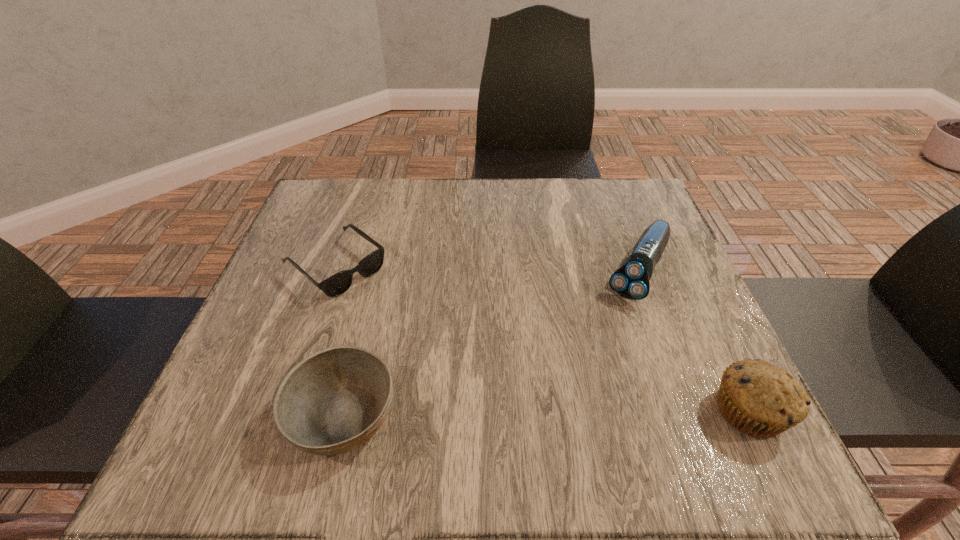
The width and height of the screenshot is (960, 540). In order to click on free location located 0.160m on the head of the electric shaver in this screenshot , I will do pos(597,357).

You are a GUI agent. You are given a task and a screenshot of the screen. Output one action in this format:
    pyautogui.click(x=<x>, y=<y>)
    Task: Click on the free space located on the head of the electric shaver
    
    Given the screenshot: What is the action you would take?
    pyautogui.click(x=589, y=373)

I want to click on bowl that is at the near edge, so click(x=333, y=401).

Where is `muffin at the near edge`? muffin at the near edge is located at coordinates (762, 400).

Locate an element on the screen. bowl at the left edge is located at coordinates (333, 401).

Identify the location of sunglasses at the left edge. Image resolution: width=960 pixels, height=540 pixels. (337, 284).

Where is `muffin that is at the right edge`? muffin that is at the right edge is located at coordinates (762, 400).

The height and width of the screenshot is (540, 960). Identify the location of electric shaver positioned at the right edge. (631, 281).

Where is `object that is positioned at the near left corner`? The width and height of the screenshot is (960, 540). object that is positioned at the near left corner is located at coordinates (333, 401).

Where is `object that is at the near right corner`? The image size is (960, 540). object that is at the near right corner is located at coordinates (762, 400).